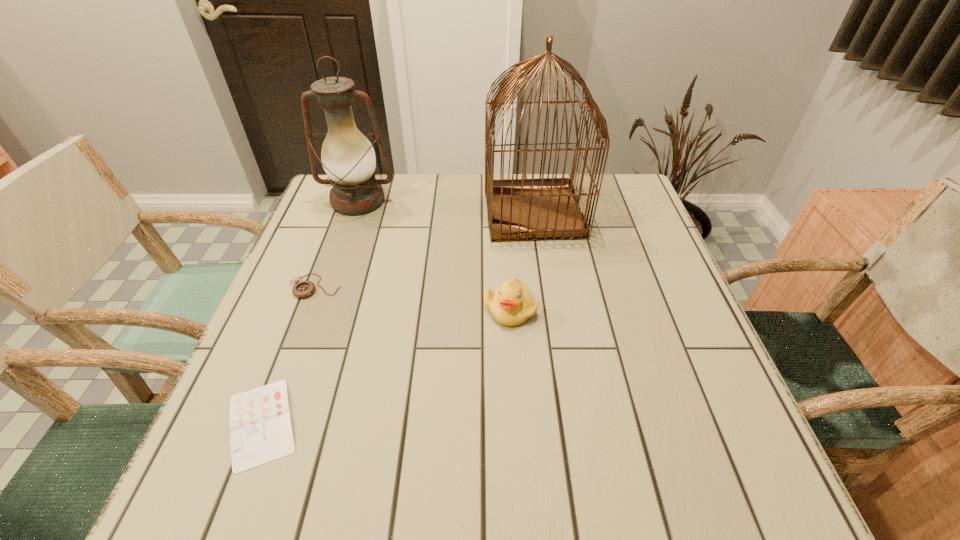
You are a GUI agent. You are given a task and a screenshot of the screen. Output one action in this format:
    pyautogui.click(x=<x>, y=<y>)
    Task: Click on the free space at the near edge of the desktop
    
    Given the screenshot: What is the action you would take?
    pyautogui.click(x=312, y=487)

In the image, there is a desktop. In order to click on vacant space at the left edge in this screenshot , I will do `click(297, 271)`.

In the image, there is a desktop. Find the location of `free space at the right edge`. free space at the right edge is located at coordinates (628, 275).

In the image, there is a desktop. At what (x,y) coordinates should I click in order to perform the action: click on vacant space at the far left corner. Please return your answer as a coordinate pair (x, y). This screenshot has height=540, width=960. Looking at the image, I should click on coord(315,221).

Locate an element on the screen. This screenshot has height=540, width=960. vacant position at the far right corner of the desktop is located at coordinates (636, 195).

At what (x,y) coordinates should I click in order to perform the action: click on empty location between the duckling and the second shortest object. Please return your answer as a coordinate pair (x, y). This screenshot has width=960, height=540. Looking at the image, I should click on (413, 298).

The height and width of the screenshot is (540, 960). Identify the location of vacant area that lies between the birdcage and the diary. (397, 318).

The width and height of the screenshot is (960, 540). In order to click on free space between the diary and the birdcage in this screenshot , I will do `click(397, 318)`.

At what (x,y) coordinates should I click in order to perform the action: click on empty location between the birdcage and the nearest object. Please return your answer as a coordinate pair (x, y). The image size is (960, 540). Looking at the image, I should click on (397, 318).

This screenshot has width=960, height=540. Identify the location of empty space that is in between the duckling and the birdcage. (522, 260).